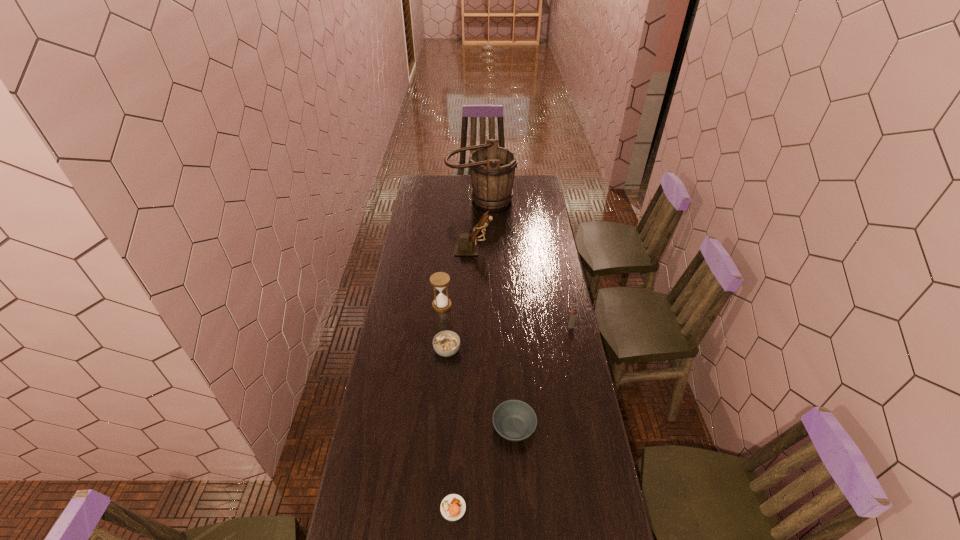
Find the location of a particular element. Image resolution: width=960 pixels, height=540 pixels. free point between the tallest object and the rightmost object is located at coordinates (526, 263).

Where is `vacant region between the fourth tallest object and the fifth farthest object`? vacant region between the fourth tallest object and the fifth farthest object is located at coordinates (509, 339).

Where is `vacant space that is in between the igniter and the hourglass`? The width and height of the screenshot is (960, 540). vacant space that is in between the igniter and the hourglass is located at coordinates (507, 316).

This screenshot has height=540, width=960. What are the coordinates of `vacant point located between the sixth nearest object and the third tallest object` in the screenshot? It's located at (458, 277).

The image size is (960, 540). What are the coordinates of `empty space between the right soup bowl and the third farthest object` in the screenshot? It's located at tap(478, 367).

Identify the location of unoccupied area between the right soup bowl and the rightmost object. Image resolution: width=960 pixels, height=540 pixels. coord(542,377).

Find the location of a particular element. The height and width of the screenshot is (540, 960). free area in between the igniter and the second farthest object is located at coordinates (522, 288).

Identify which object is located as the nearest to the right soup bowl. Please provide its 2D coordinates. Your answer should be formatted as a tuple, i.e. [(x, y)], where the tuple contains the x and y coordinates of a point satisfying the conditions above.

[(453, 507)]

Select which object is the sixth closest to the figurine. Please provide its 2D coordinates. Your answer should be formatted as a tuple, i.e. [(x, y)], where the tuple contains the x and y coordinates of a point satisfying the conditions above.

[(453, 507)]

The image size is (960, 540). What are the coordinates of `blank space that satisfies the following two spatial constraints: 1. on the handle side of the tallest object; 2. on the front-facing side of the figurine` in the screenshot? It's located at (481, 248).